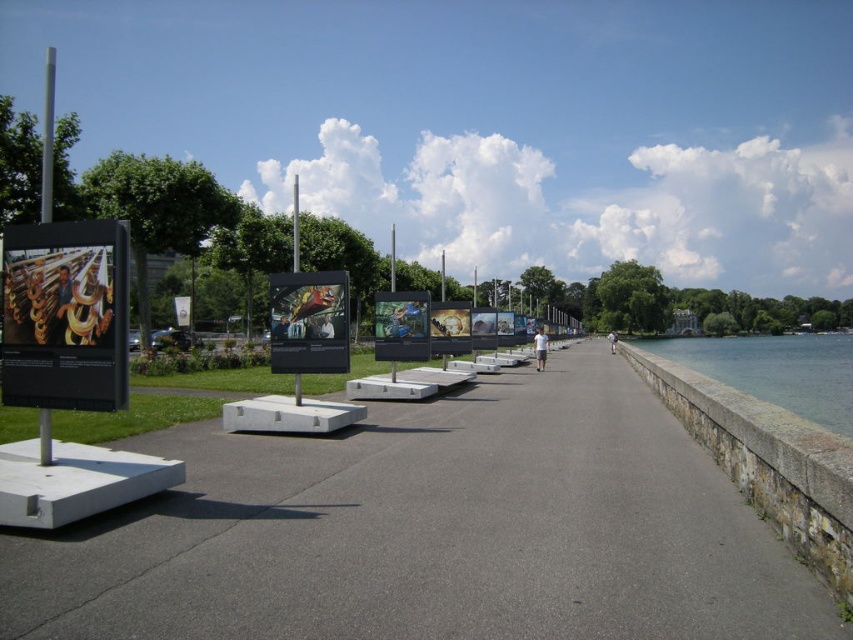
Does metallic reflective poster at center have a larger size compared to white fabric person at center?

No.

Is metallic reflective poster at center to the right of white fabric person at center from the viewer's perspective?

Incorrect, metallic reflective poster at center is not on the right side of white fabric person at center.

Measure the distance between point (403, 330) and camera.

The distance of point (403, 330) from camera is 18.45 meters.

Find the location of `metallic reflective poster at center`. metallic reflective poster at center is located at coordinates (401, 324).

Measure the distance between gray concrete path at center and camera.

4.21 meters

Does gray concrete path at center appear over gray stone wall at right?

Correct, gray concrete path at center is located above gray stone wall at right.

Between point (477, 387) and point (769, 358), which one is positioned in front?

Positioned in front is point (477, 387).

You are a GUI agent. You are given a task and a screenshot of the screen. Output one action in this format:
    pyautogui.click(x=<x>, y=<y>)
    Task: Click on the gray concrete path at center
    
    Given the screenshot: What is the action you would take?
    pyautogui.click(x=430, y=531)

Can you confirm if gray concrete path at center is thinner than matte black sign at left?

No, gray concrete path at center is not thinner than matte black sign at left.

Is gray concrete path at center to the right of matte black sign at left from the viewer's perspective?

Indeed, gray concrete path at center is positioned on the right side of matte black sign at left.

This screenshot has width=853, height=640. Find the location of `gray concrete path at center`. gray concrete path at center is located at coordinates (430, 531).

Locate an element on the screen. This screenshot has height=640, width=853. gray concrete path at center is located at coordinates (430, 531).